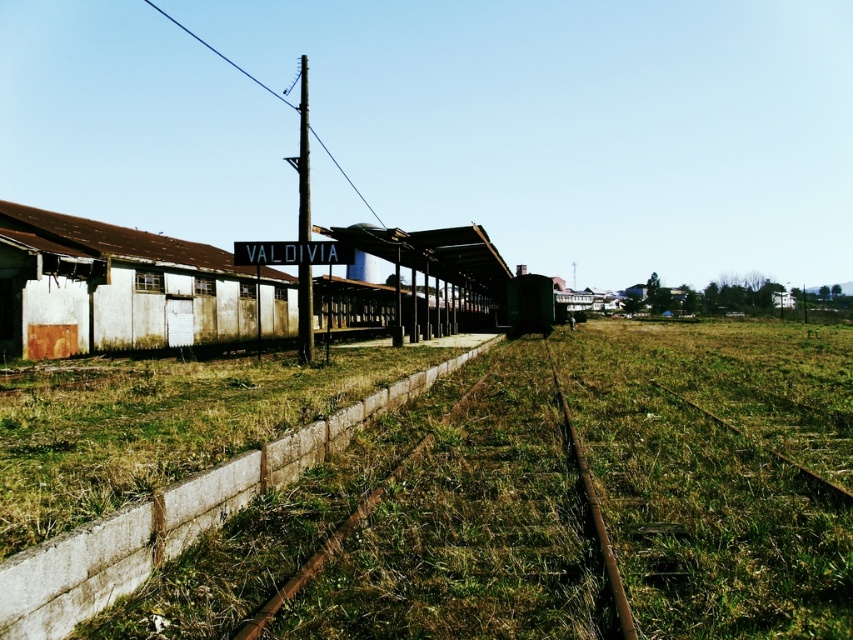
Looking at this image, does metallic pole at center appear over rusty metal train track at center?

Indeed, metallic pole at center is positioned over rusty metal train track at center.

Can you confirm if metallic pole at center is shorter than rusty metal train track at center?

In fact, metallic pole at center may be taller than rusty metal train track at center.

Is point (299, 156) positioned before point (613, 602)?

No.

The height and width of the screenshot is (640, 853). What are the coordinates of `metallic pole at center` in the screenshot? It's located at (303, 157).